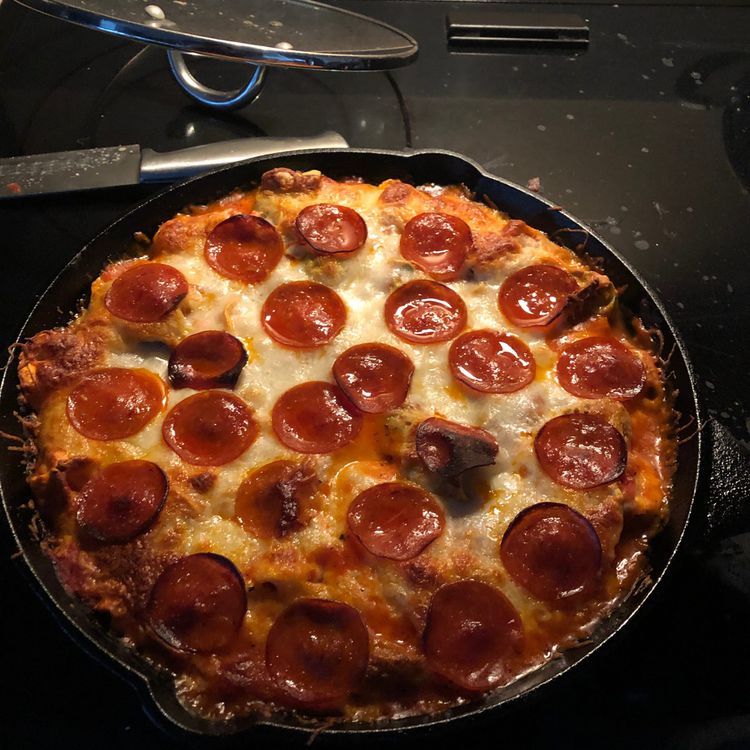
Locate an element on the screen. The image size is (750, 750). handle is located at coordinates (230, 150).